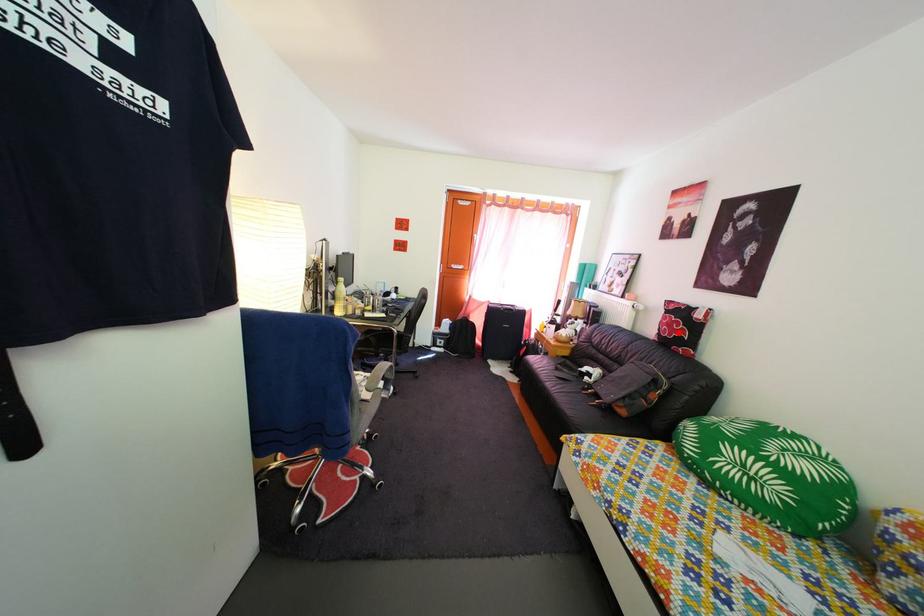
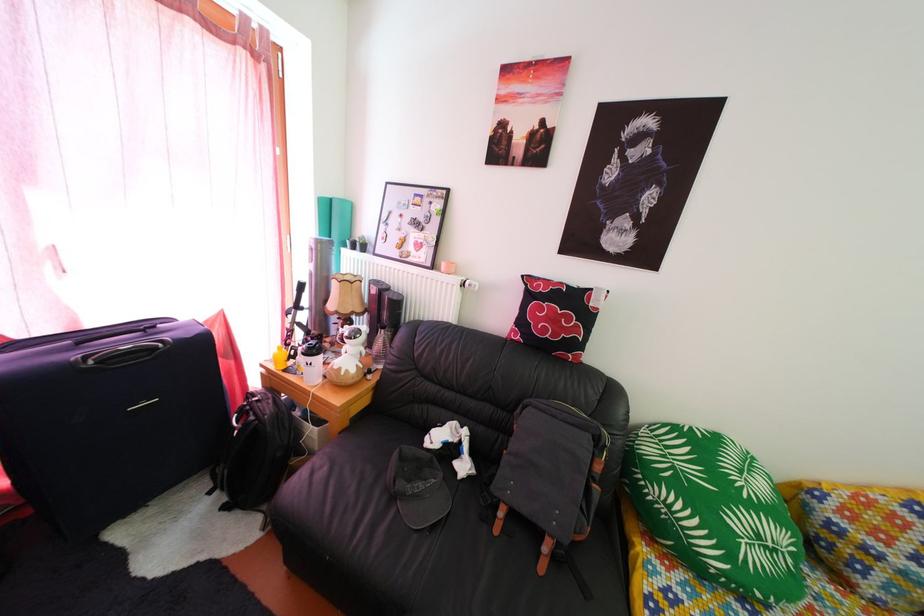
In the second image, find the point that corresponds to the highlighted location in the first image.

(562, 328)